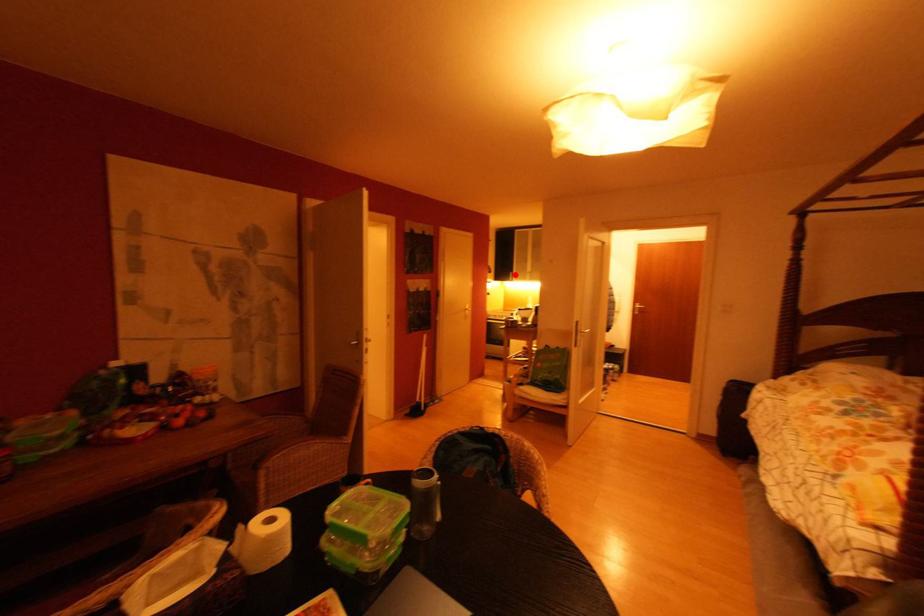
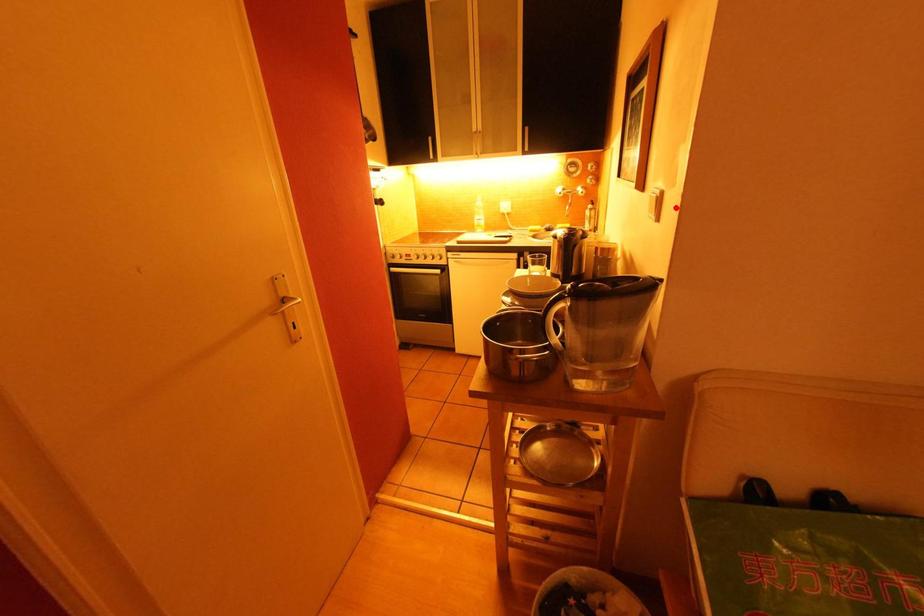
I am providing you with two images of the same scene from different viewpoints. A red point is marked on the first image and another point is marked on the second image. Does the point marked in image1 correspond to the same location as the one in image2?

No